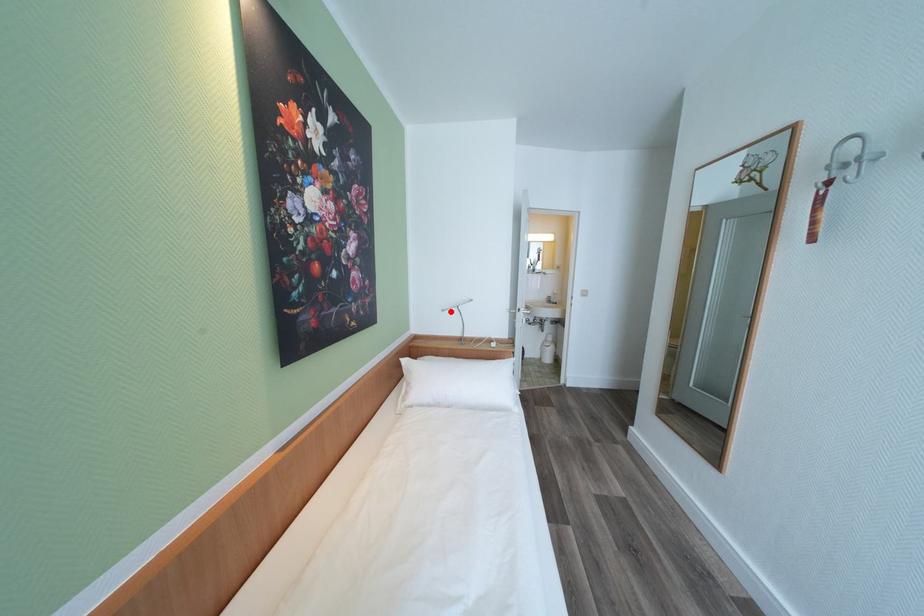
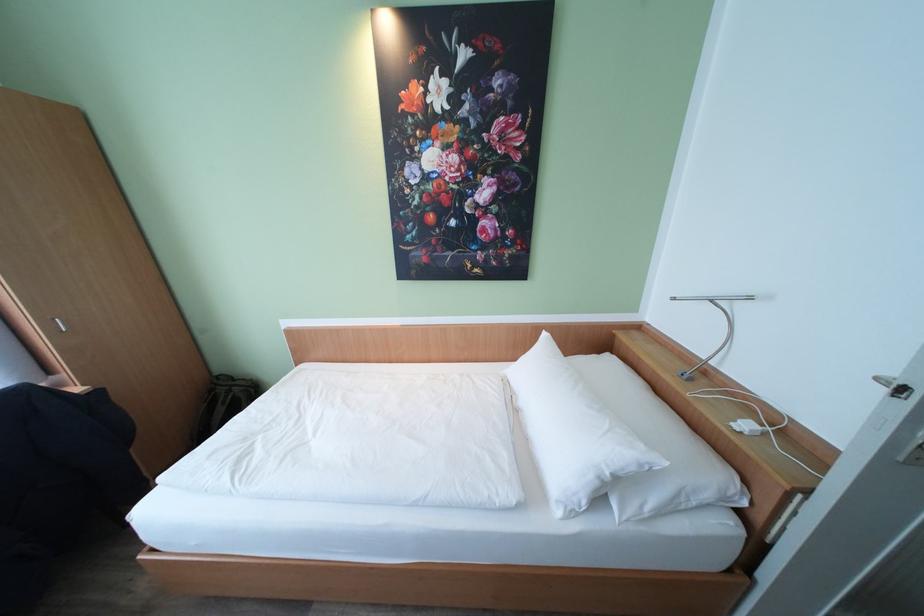
Question: I am providing you with two images of the same scene from different viewpoints. Image1 has a red point marked. In image2, the corresponding 3D location appears at what relative position? Reply with the corresponding letter.

Choices:
 (A) Closer
 (B) Farther

Answer: (A)